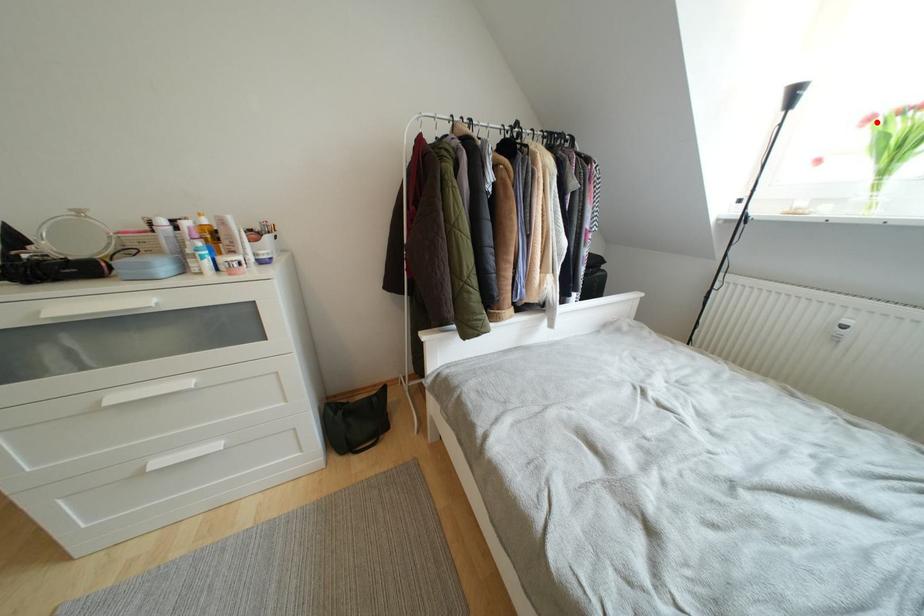
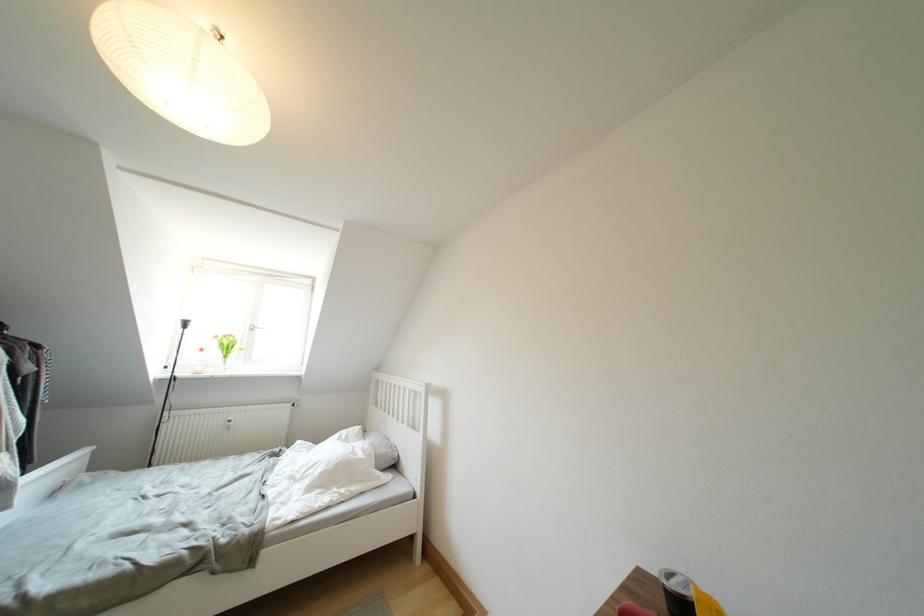
In the second image, find the point that corresponds to the highlighted location in the first image.

(222, 341)